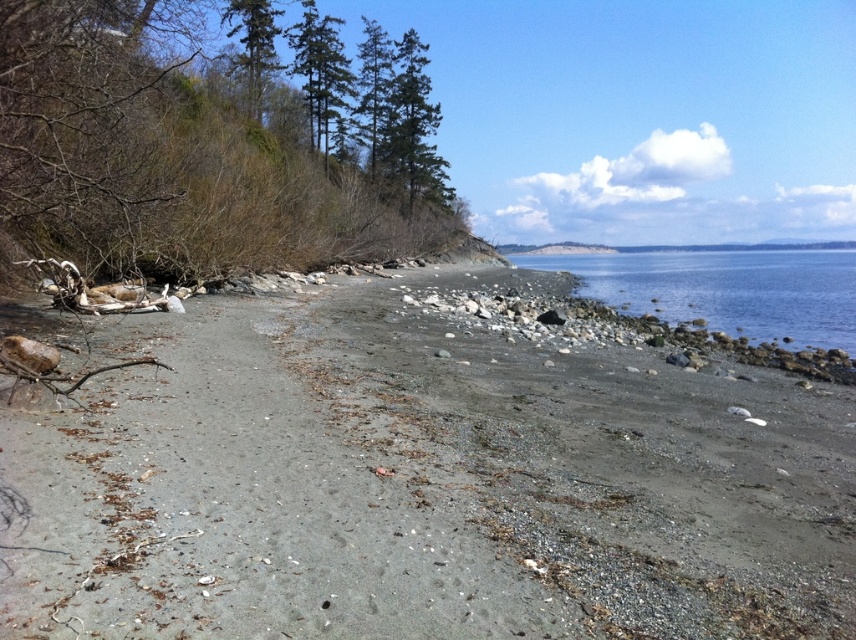
Question: Which object appears closest to the camera in this image?

Choices:
 (A) clear blue water at center
 (B) gray gravel beach at center

Answer: (B)

Question: Can you confirm if gray gravel beach at center is positioned below clear blue water at center?

Choices:
 (A) no
 (B) yes

Answer: (B)

Question: Among these points, which one is farthest from the camera?

Choices:
 (A) (854, 321)
 (B) (455, 580)

Answer: (A)

Question: Does gray gravel beach at center appear under clear blue water at center?

Choices:
 (A) yes
 (B) no

Answer: (A)

Question: Is gray gravel beach at center positioned before clear blue water at center?

Choices:
 (A) no
 (B) yes

Answer: (B)

Question: Which point is farther from the camera taking this photo?

Choices:
 (A) (245, 620)
 (B) (700, 310)

Answer: (B)